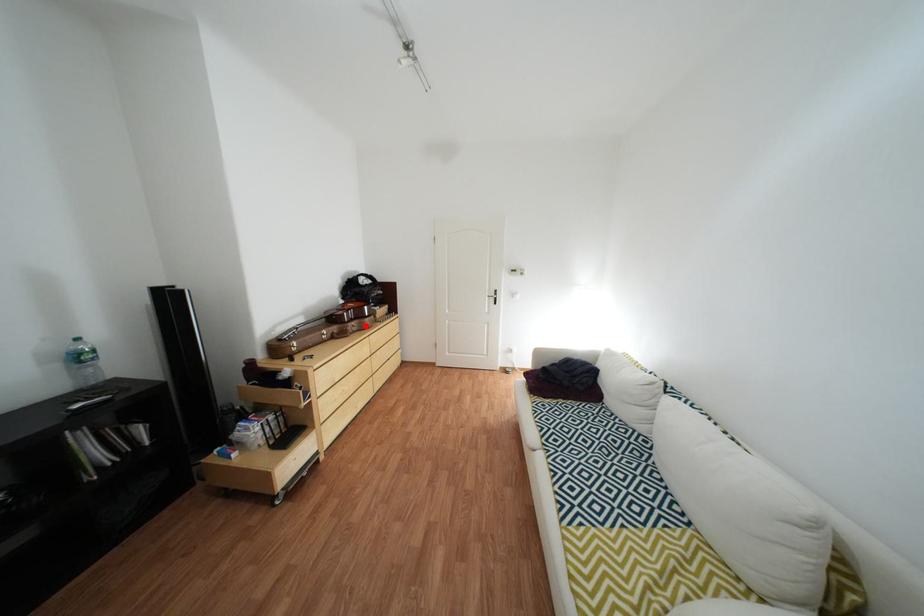
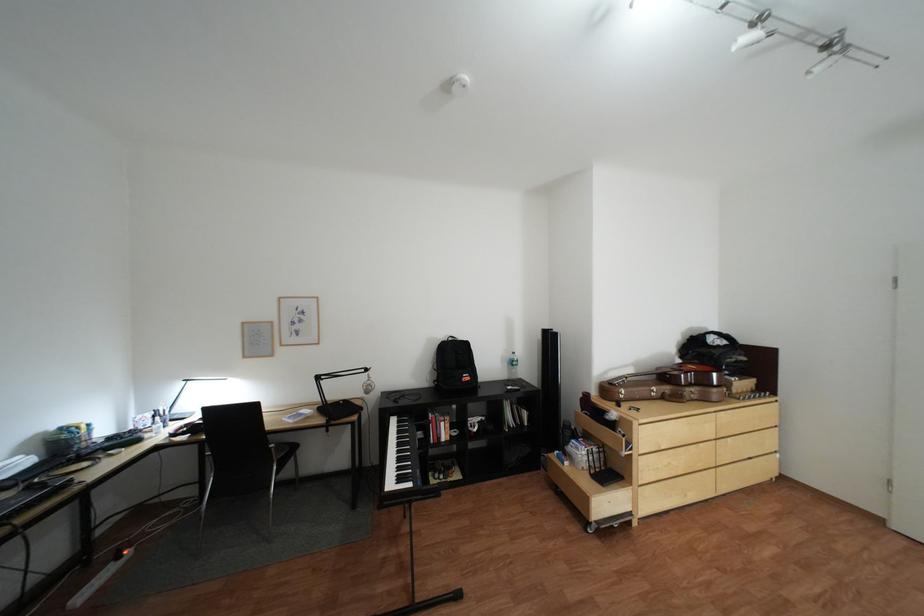
Question: I am providing you with two images of the same scene from different viewpoints. In image1, a red point is highlighted. Considering the same 3D point in image2, which of the following is correct?

Choices:
 (A) It is closer
 (B) It is farther

Answer: (B)